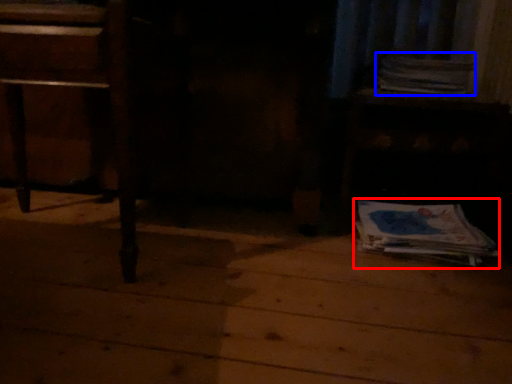
Question: Which object appears farthest to the camera in this image, paperback book (highlighted by a red box) or paperback book (highlighted by a blue box)?

Choices:
 (A) paperback book
 (B) paperback book

Answer: (B)